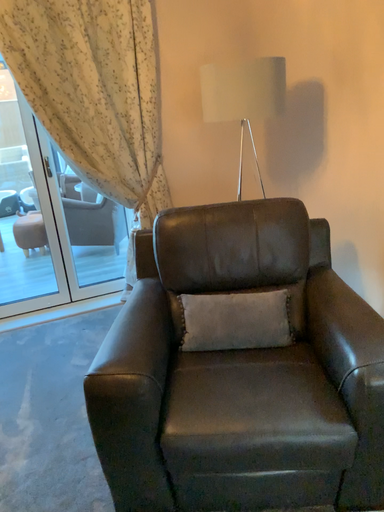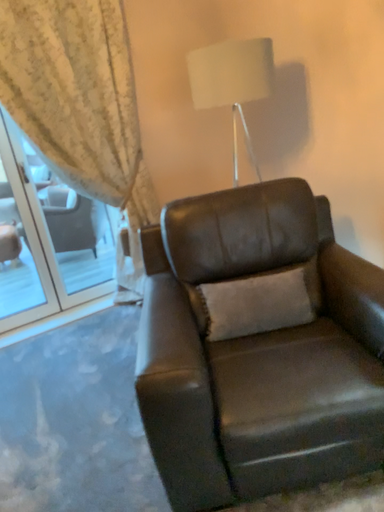
Question: How did the camera likely rotate when shooting the video?

Choices:
 (A) rotated right
 (B) rotated left

Answer: (A)